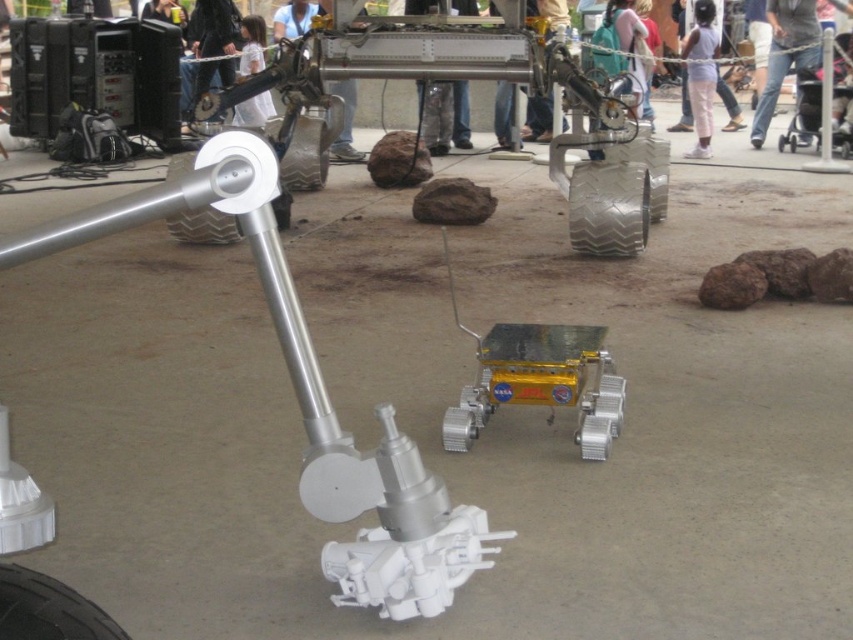
You are an engineer observing the robotic setup. You notice the white cotton pants at upper right and the white rubber tire at center. Which object is positioned higher in the image?

The white cotton pants at upper right is much taller than the white rubber tire at center, so it is positioned higher in the image.

You are an engineer inspecting the robotic setup. You need to locate the black rubber tire at lower left. Where exactly is it positioned in the image?

The black rubber tire at lower left is positioned at point (48, 609) in the image.

You are an engineer inspecting a robotic setup. You notice a point marked at coordinates (608,208). Based on the scene, can you determine what object this point is located on?

The point at coordinates (608,208) is located on the metallic textured tire at center.